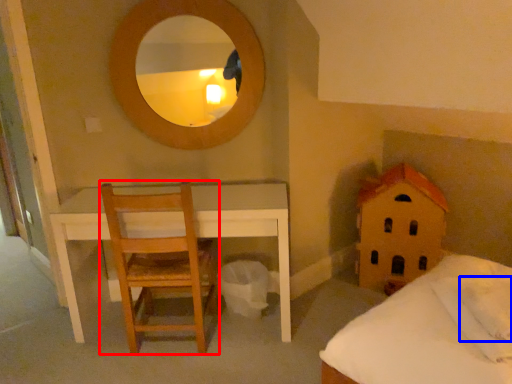
Question: Among these objects, which one is farthest to the camera, chair (highlighted by a red box) or pillow (highlighted by a blue box)?

Choices:
 (A) chair
 (B) pillow

Answer: (A)